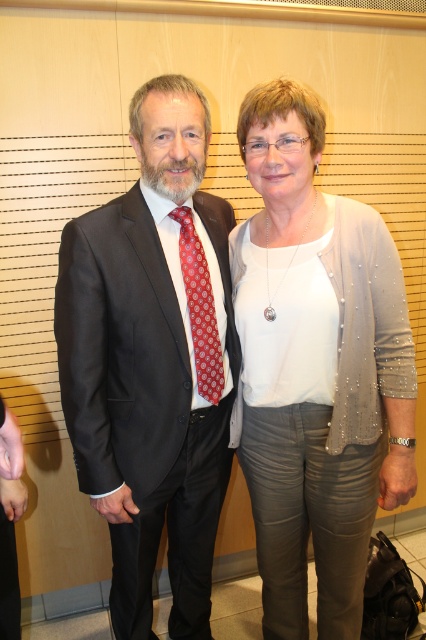
Is matte black suit at center bigger than red dotted tie at center?

Indeed, matte black suit at center has a larger size compared to red dotted tie at center.

Can you confirm if matte black suit at center is positioned above red dotted tie at center?

→ No.

Locate an element on the screen. This screenshot has height=640, width=426. matte black suit at center is located at coordinates (152, 362).

Which is above, pearl gray cardigan at center or matte black suit at center?

pearl gray cardigan at center is higher up.

Is pearl gray cardigan at center further to the viewer compared to matte black suit at center?

No.

Is point (253, 352) behind point (198, 150)?

That is True.

The width and height of the screenshot is (426, 640). I want to click on pearl gray cardigan at center, so click(316, 369).

Where is `pearl gray cardigan at center`? This screenshot has height=640, width=426. pearl gray cardigan at center is located at coordinates (316, 369).

Locate an element on the screen. Image resolution: width=426 pixels, height=640 pixels. pearl gray cardigan at center is located at coordinates (316, 369).